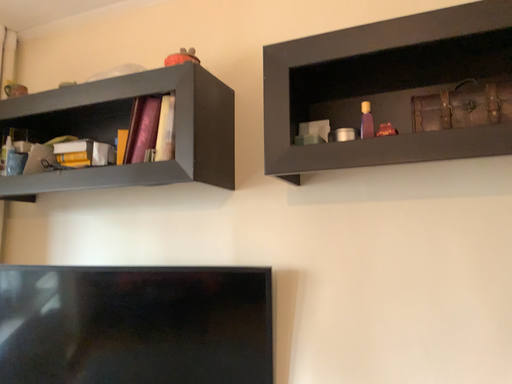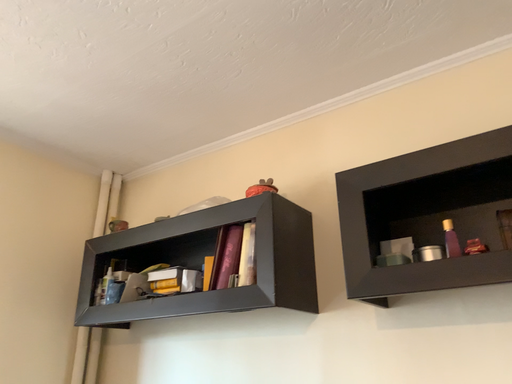
Question: Which way did the camera rotate in the video?

Choices:
 (A) rotated upward
 (B) rotated downward

Answer: (A)